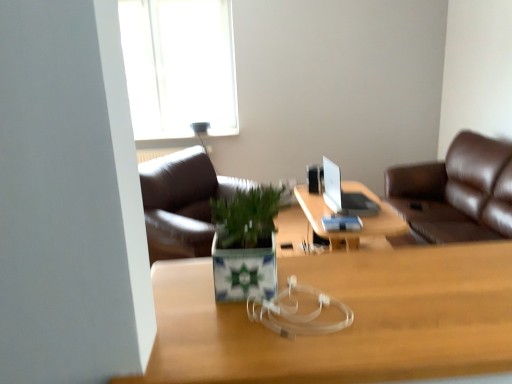
Question: Considering the positions of wooden table at center and wooden desk at center in the image, is wooden table at center taller or shorter than wooden desk at center?

Choices:
 (A) short
 (B) tall

Answer: (B)

Question: From the image's perspective, relative to wooden desk at center, is wooden table at center above or below?

Choices:
 (A) above
 (B) below

Answer: (B)

Question: Which is farther from the silver metallic laptop at center?

Choices:
 (A) green ceramic pot at center
 (B) transparent glass window at upper center
 (C) wooden table at center
 (D) wooden desk at center

Answer: (B)

Question: Considering the real-world distances, which object is closest to the green ceramic pot at center?

Choices:
 (A) transparent glass window at upper center
 (B) silver metallic laptop at center
 (C) wooden desk at center
 (D) wooden table at center

Answer: (C)